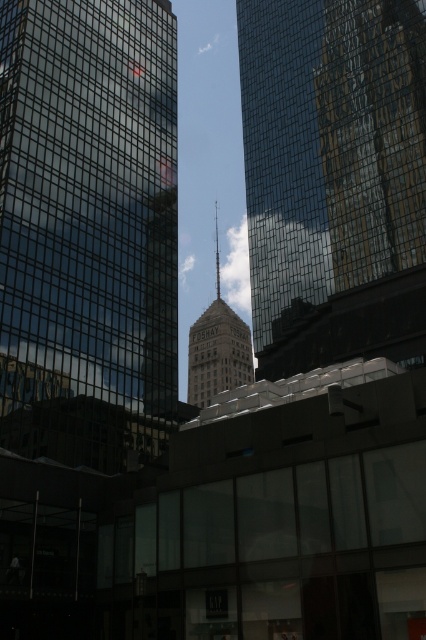
Between reflective glass skyscraper at center and matte glass tower at center, which one appears on the right side from the viewer's perspective?

reflective glass skyscraper at center

Is point (365, 48) farther from camera compared to point (201, 323)?

That is False.

Between point (374, 333) and point (227, 384), which one is positioned behind?

Point (227, 384)

This screenshot has width=426, height=640. I want to click on reflective glass skyscraper at center, so click(x=333, y=179).

Does transparent glass skyscraper at left appear on the left side of reflective glass skyscraper at center?

Yes, transparent glass skyscraper at left is to the left of reflective glass skyscraper at center.

Is transparent glass skyscraper at left bigger than reflective glass skyscraper at center?

No, transparent glass skyscraper at left is not bigger than reflective glass skyscraper at center.

Is point (42, 253) positioned before point (331, 355)?

Yes, point (42, 253) is in front of point (331, 355).

In order to click on transparent glass skyscraper at left in this screenshot , I will do `click(88, 228)`.

Does transparent glass skyscraper at left lie behind matte glass tower at center?

No, it is not.

Between transparent glass skyscraper at left and matte glass tower at center, which one is positioned lower?

matte glass tower at center is below.

Which is behind, point (121, 125) or point (201, 390)?

The point (201, 390) is more distant.

Where is `transparent glass skyscraper at left`? This screenshot has height=640, width=426. transparent glass skyscraper at left is located at coordinates (88, 228).